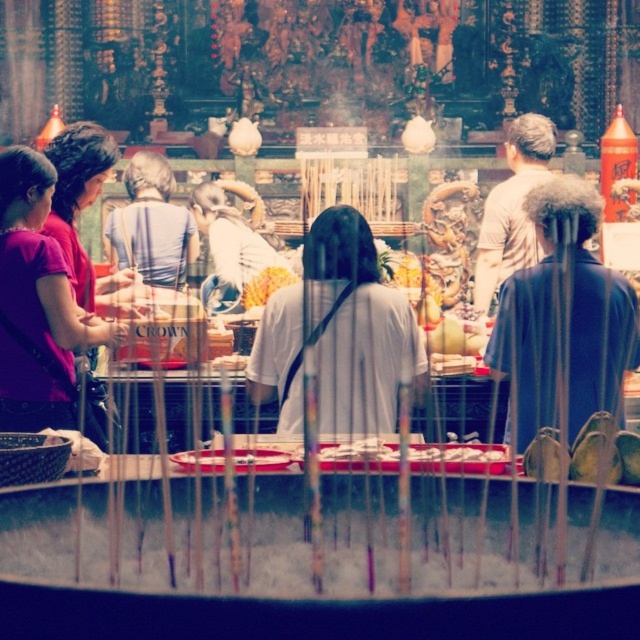
Question: Where is matte purple shirt at left located in relation to yellow flower at center in the image?

Choices:
 (A) above
 (B) below

Answer: (B)

Question: Observing the image, what is the correct spatial positioning of matte purple shirt at left in reference to yellow flower at center?

Choices:
 (A) above
 (B) below

Answer: (B)

Question: Can you confirm if matte purple shirt at left is bigger than yellow flower at center?

Choices:
 (A) yes
 (B) no

Answer: (A)

Question: Which point is closer to the camera?

Choices:
 (A) (266, 272)
 (B) (35, 209)

Answer: (B)